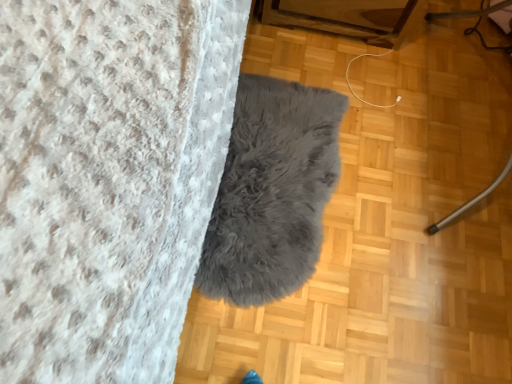
Identify the location of free space behind gray fluffy rug at center. This screenshot has height=384, width=512. (351, 73).